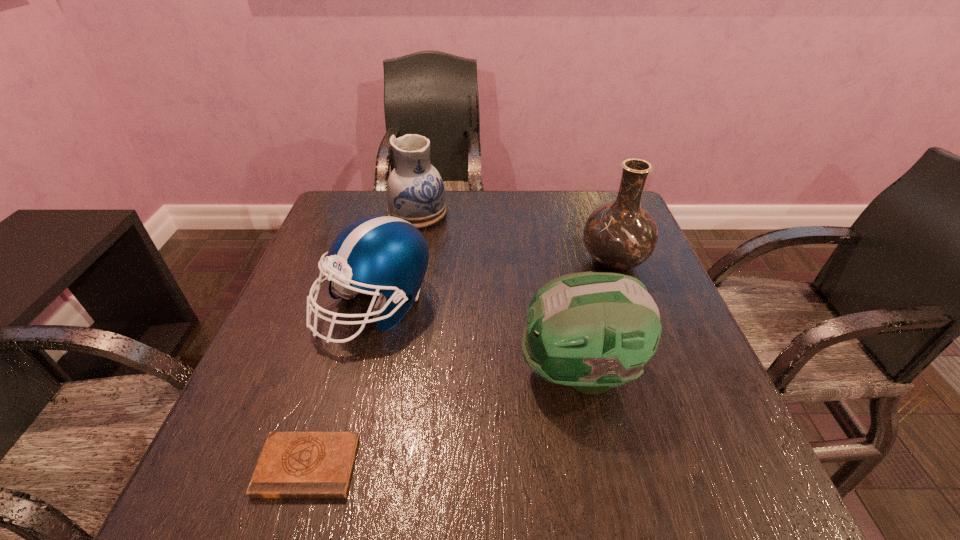
Where is `the tallest object`? the tallest object is located at coordinates (621, 235).

Identify the location of pottery. (415, 192).

I want to click on the right football helmet, so click(593, 331).

Locate an element on the screen. The width and height of the screenshot is (960, 540). the left football helmet is located at coordinates (388, 255).

The height and width of the screenshot is (540, 960). Find the location of `the shortest object`. the shortest object is located at coordinates (292, 464).

Locate an element on the screen. diary is located at coordinates (292, 464).

Locate an element on the screen. This screenshot has width=960, height=540. vacant space situated 0.400m on the front of the tallest object is located at coordinates (681, 450).

The image size is (960, 540). I want to click on free space located 0.070m on the right of the pottery, so click(x=471, y=213).

At what (x,y) coordinates should I click in order to perform the action: click on free spot located 0.140m on the visor of the right football helmet. Please return your answer as a coordinate pair (x, y). Looking at the image, I should click on (444, 372).

Where is `vacant space situated on the visor of the right football helmet`? vacant space situated on the visor of the right football helmet is located at coordinates (354, 372).